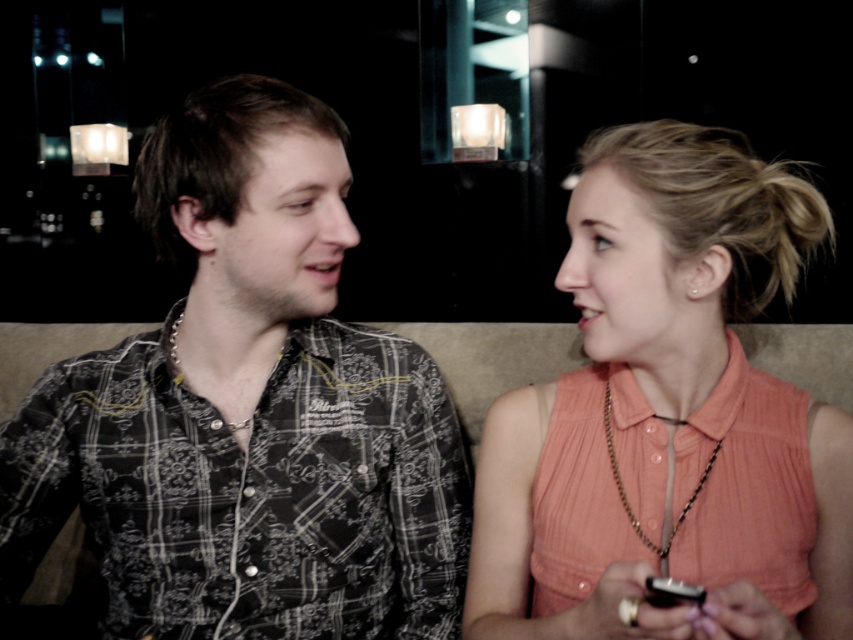
You are a photographer setting up for a portrait shoot in a bar. You have two subjects wearing the patterned fabric shirt at left and the gold chain necklace at upper right. To ensure both are in focus, you need to know their height difference. Which subject is taller?

The patterned fabric shirt at left is taller than the gold chain necklace at upper right, so the subject wearing the patterned fabric shirt at left is taller.

You are designing a seating arrangement for a small booth in a restaurant. The booth has a bench seat that can accommodate two people. You need to ensure there is enough space between the patterned fabric shirt at left and the matte peach blouse at right. Based on their clothing widths, can they sit side by side without their clothes overlapping?

The patterned fabric shirt at left is wider than the matte peach blouse at right. Since the booth bench can fit two people, they can sit side by side, but there may be some overlap depending on their posture and exact positioning. The total combined width of their clothing suggests they need at least the sum of both widths for comfort, but the booth might be designed for standard seating. However, based on the given information, the shirt is wider, so they should adjust their positions to avoid overlap.